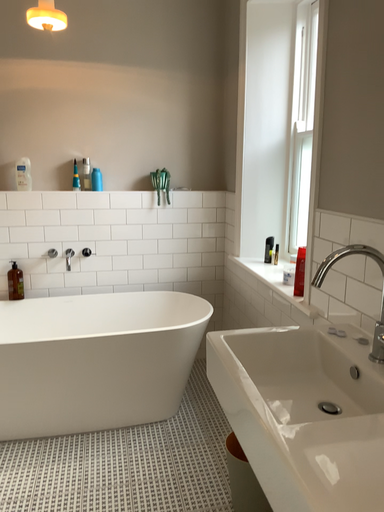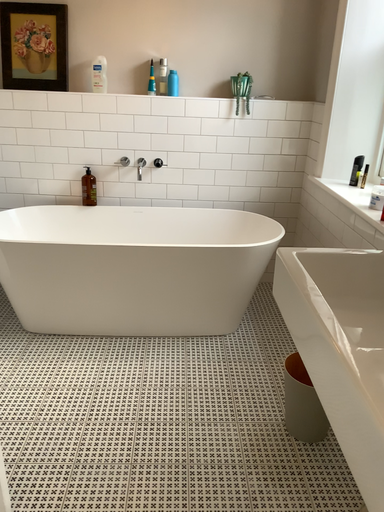
Question: How did the camera likely rotate when shooting the video?

Choices:
 (A) rotated left
 (B) rotated right

Answer: (A)